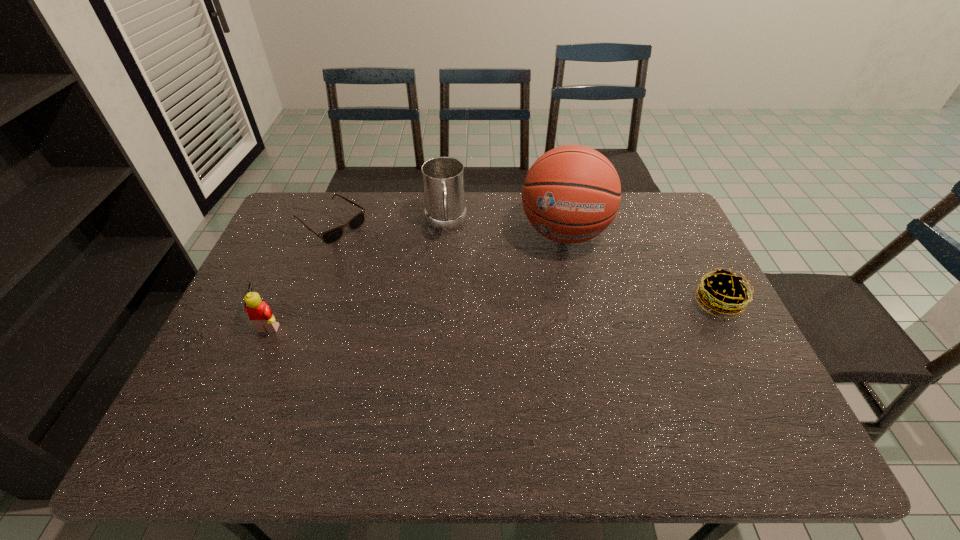
This screenshot has width=960, height=540. Identify the location of the third tallest object. point(260,314).

Where is `the second shortest object`? the second shortest object is located at coordinates (724, 293).

This screenshot has width=960, height=540. Identify the location of patty. [724, 293].

Image resolution: width=960 pixels, height=540 pixels. I want to click on basketball, so click(572, 193).

You are a GUI agent. You are given a task and a screenshot of the screen. Output one action in this format:
    pyautogui.click(x=<x>, y=<y>)
    Task: Click on the tallest object
    This screenshot has height=540, width=960.
    Given the screenshot: What is the action you would take?
    pyautogui.click(x=572, y=193)

Identify the location of the third object from left to right. (443, 177).

At what (x,y) coordinates should I click in order to perform the action: click on mug. Please return your answer as a coordinate pair (x, y). The image size is (960, 540). Looking at the image, I should click on (443, 177).

You are a GUI agent. You are given a task and a screenshot of the screen. Output one action in this format:
    pyautogui.click(x=<x>, y=<y>)
    Task: Click on the sunglasses
    The image size is (960, 540).
    Given the screenshot: What is the action you would take?
    pyautogui.click(x=330, y=236)

Where is `vacant space positioned 0.070m in front of the Lego with the accessory visible`? vacant space positioned 0.070m in front of the Lego with the accessory visible is located at coordinates (228, 321).

This screenshot has height=540, width=960. Identify the location of free location located 0.070m in front of the Lego with the accessory visible. (228, 321).